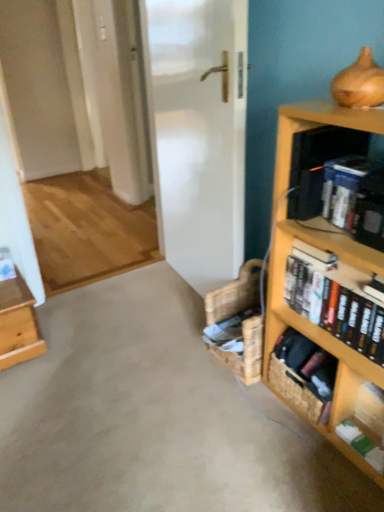
The height and width of the screenshot is (512, 384). In order to click on blank area to the left of green matte book at lower right, which is the 1th book in bottom-to-top order in this screenshot , I will do `click(318, 460)`.